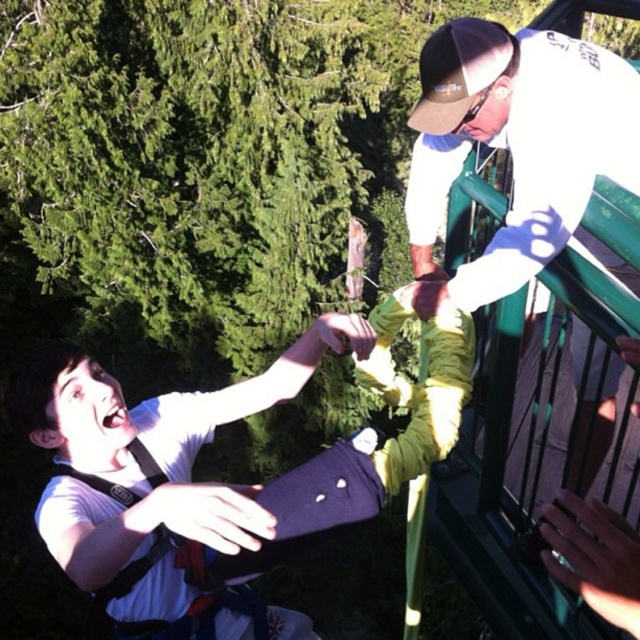
Is white matte shirt at center thinner than white matte baseball cap at upper right?

Indeed, white matte shirt at center has a lesser width compared to white matte baseball cap at upper right.

Between white matte shirt at center and white matte baseball cap at upper right, which one is positioned lower?

white matte shirt at center

Between point (371, 326) and point (528, 100), which one is positioned behind?

Positioned behind is point (371, 326).

The height and width of the screenshot is (640, 640). I want to click on white matte shirt at center, so click(x=211, y=436).